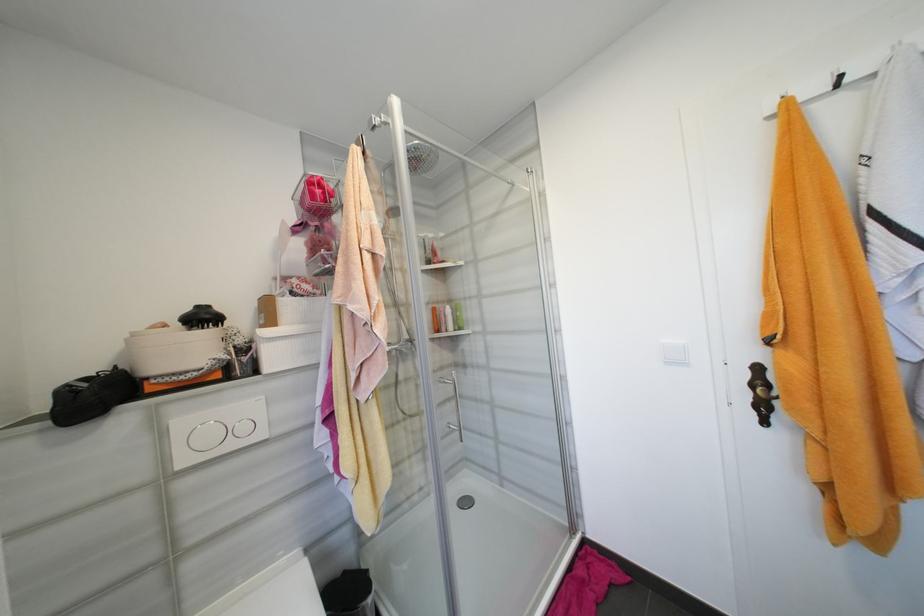
Describe the element at coordinates (201, 317) in the screenshot. I see `a black round brush` at that location.